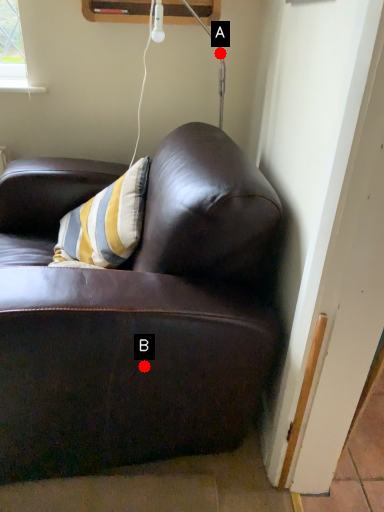
Question: Two points are circled on the image, labeled by A and B beside each circle. Which of the following is the farthest from the observer?

Choices:
 (A) A is further
 (B) B is further

Answer: (A)